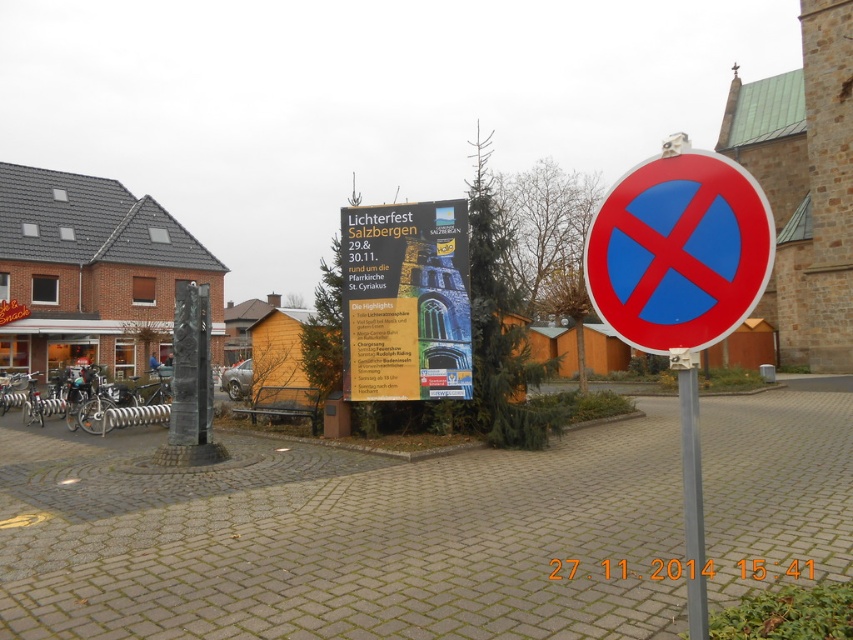
Is point (381, 372) more distant than point (685, 467)?

Yes, it is.

Who is more forward, (437, 273) or (706, 628)?

Positioned in front is point (706, 628).

The width and height of the screenshot is (853, 640). I want to click on white paper poster at center, so click(x=405, y=301).

Is point (625, 273) closer to camera compared to point (368, 216)?

Yes, it is in front of point (368, 216).

This screenshot has width=853, height=640. In order to click on red plastic sign at center in this screenshot , I will do (x=682, y=285).

Is red plastic circle at right behind white paper poster at center?

That is False.

Who is more forward, (714, 323) or (440, 396)?

Positioned in front is point (714, 323).

The width and height of the screenshot is (853, 640). Find the location of `red plastic circle at right`. red plastic circle at right is located at coordinates click(679, 252).